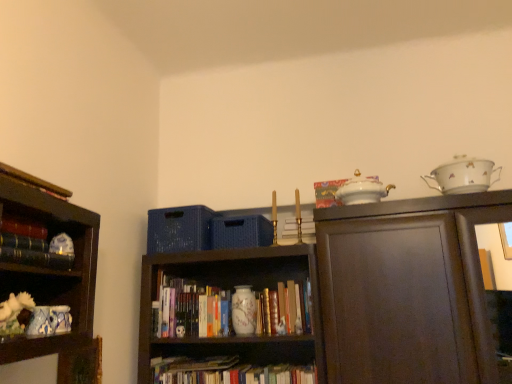
Locate an element on the screen. The height and width of the screenshot is (384, 512). white porcelain tea set at upper right is located at coordinates (463, 175).

What do you see at coordinates (190, 310) in the screenshot?
I see `hardcover books at center, the second book in the left-to-right sequence` at bounding box center [190, 310].

How much space does hardcover books at center, arranged as the 2th book when viewed from the right, occupy horizontally?

hardcover books at center, arranged as the 2th book when viewed from the right, is 32.24 centimeters in width.

Locate an element on the screen. hardcover book at center, placed as the 2th book when sorted from front to back is located at coordinates (284, 309).

Based on the photo, considering their positions, is hardcover book at center, which appears as the second book when viewed from the back, located in front of or behind white porcelain teapot at upper center?

hardcover book at center, which appears as the second book when viewed from the back, is positioned farther from the viewer than white porcelain teapot at upper center.

Looking at the image, does hardcover book at center, placed as the 2th book when sorted from front to back, seem bigger or smaller compared to white porcelain teapot at upper center?

In the image, hardcover book at center, placed as the 2th book when sorted from front to back, appears to be smaller than white porcelain teapot at upper center.

Could white porcelain teapot at upper center be considered to be inside hardcover book at center, which appears as the second book when viewed from the back?

No, white porcelain teapot at upper center is not inside hardcover book at center, which appears as the second book when viewed from the back.

Is point (293, 326) closer to viewer compared to point (360, 190)?

No, (293, 326) is behind (360, 190).

Identify the location of book that appears in front of the white porcelain tea set at upper right. This screenshot has width=512, height=384. (36, 258).

Is matte black book at left, placed as the third book when sorted from back to front, far away from white porcelain tea set at upper right?

matte black book at left, placed as the third book when sorted from back to front, is positioned a significant distance from white porcelain tea set at upper right.

Is matte black book at left, which ranks as the third book in bottom-to-top order, turned away from white porcelain tea set at upper right?

matte black book at left, which ranks as the third book in bottom-to-top order, does not have its back to white porcelain tea set at upper right.

Can you confirm if matte black book at left, placed as the third book when sorted from back to front, is positioned to the left of white porcelain tea set at upper right?

Yes, matte black book at left, placed as the third book when sorted from back to front, is to the left of white porcelain tea set at upper right.

What's the angular difference between white porcelain tea set at upper right and hardcover book at center, the 2th book viewed from the top,'s facing directions?

The angle between the facing direction of white porcelain tea set at upper right and the facing direction of hardcover book at center, the 2th book viewed from the top, is 0.272 degrees.

Does white porcelain tea set at upper right have a larger size compared to hardcover book at center, which ranks as the 3th book in left-to-right order?

Yes.

Is white porcelain tea set at upper right not near hardcover book at center, placed as the 2th book when sorted from front to back?

No, white porcelain tea set at upper right is not far from hardcover book at center, placed as the 2th book when sorted from front to back.

Would you say white porcelain tea set at upper right is to the left or to the right of hardcover book at center, which is the 2th book in bottom-to-top order, in the picture?

Based on their positions, white porcelain tea set at upper right is located to the right of hardcover book at center, which is the 2th book in bottom-to-top order.

Between hardcover book at center, which ranks as the 3th book in left-to-right order, and hardcover books at center, which appears as the third book when viewed from the top, which one has larger width?

Wider between the two is hardcover books at center, which appears as the third book when viewed from the top.

Is hardcover book at center, which is the 2th book in bottom-to-top order, with hardcover books at center, arranged as the 2th book when viewed from the right?

There is a gap between hardcover book at center, which is the 2th book in bottom-to-top order, and hardcover books at center, arranged as the 2th book when viewed from the right.

Is hardcover book at center, which is the 2th book in bottom-to-top order, oriented towards hardcover books at center, which is the 1th book in back-to-front order?

No, hardcover book at center, which is the 2th book in bottom-to-top order, is not turned towards hardcover books at center, which is the 1th book in back-to-front order.

From the picture: Considering the positions of objects hardcover book at center, which ranks as the 3th book in left-to-right order, and hardcover books at center, arranged as the 2th book when viewed from the right, in the image provided, who is more to the right, hardcover book at center, which ranks as the 3th book in left-to-right order, or hardcover books at center, arranged as the 2th book when viewed from the right,?

From the viewer's perspective, hardcover book at center, which ranks as the 3th book in left-to-right order, appears more on the right side.

Is matte black book at left, positioned as the first book in left-to-right order, to the left of hardcover book at center, which is the 2th book in bottom-to-top order, from the viewer's perspective?

Yes.

Does matte black book at left, positioned as the first book in left-to-right order, have a lesser width compared to hardcover book at center, the 2th book viewed from the top?

Yes.

From the picture: How different are the orientations of matte black book at left, positioned as the first book in left-to-right order, and hardcover book at center, which is the 2th book in bottom-to-top order, in degrees?

94.2 degrees separate the facing orientations of matte black book at left, positioned as the first book in left-to-right order, and hardcover book at center, which is the 2th book in bottom-to-top order.

Looking at this image, from a real-world perspective, is matte black book at left, positioned as the third book in right-to-left order, positioned above or below hardcover book at center, placed as the 2th book when sorted from front to back?

From a real-world perspective, matte black book at left, positioned as the third book in right-to-left order, is physically above hardcover book at center, placed as the 2th book when sorted from front to back.

Can you tell me how much hardcover books at center, the second book in the left-to-right sequence, and white porcelain teapot at upper center differ in facing direction?

There is a 1.98-degree angle between the facing directions of hardcover books at center, the second book in the left-to-right sequence, and white porcelain teapot at upper center.

Does point (170, 289) appear closer or farther from the camera than point (352, 179)?

Point (170, 289) is positioned farther from the camera compared to point (352, 179).

This screenshot has width=512, height=384. In the image, there is a hardcover books at center, which is the 1th book in back-to-front order. What are the coordinates of `tea pot above it (from the image's perspective)` in the screenshot? It's located at (362, 190).

From their relative heights in the image, would you say hardcover books at center, the 1th book ordered from the bottom, is taller or shorter than white porcelain teapot at upper center?

Considering their sizes, hardcover books at center, the 1th book ordered from the bottom, has more height than white porcelain teapot at upper center.

Consider the image. Between white porcelain teapot at upper center and matte black book at left, the first book viewed from the front, which one has more height?

white porcelain teapot at upper center is taller.

From a real-world perspective, is white porcelain teapot at upper center under matte black book at left, which is the first book from top to bottom?

Actually, white porcelain teapot at upper center is physically above matte black book at left, which is the first book from top to bottom, in the real world.

Is white porcelain teapot at upper center facing towards matte black book at left, the first book viewed from the front?

No, white porcelain teapot at upper center does not turn towards matte black book at left, the first book viewed from the front.

Is white porcelain teapot at upper center not close to matte black book at left, positioned as the third book in right-to-left order?

Absolutely, white porcelain teapot at upper center is distant from matte black book at left, positioned as the third book in right-to-left order.

Identify the location of the 1st book behind when counting from the white porcelain teapot at upper center. coord(284,309).

Find the location of a particular element. book in front of the white porcelain tea set at upper right is located at coordinates (36, 258).

Which object lies nearer to the anchor point white porcelain tea set at upper right, white porcelain teapot at upper center or matte black book at left, positioned as the third book in right-to-left order?

Among the two, white porcelain teapot at upper center is located nearer to white porcelain tea set at upper right.

Considering their positions, is hardcover book at center, the first book from the right, positioned closer to white porcelain tea set at upper right than white porcelain teapot at upper center?

Among the two, white porcelain teapot at upper center is located nearer to white porcelain tea set at upper right.

When comparing their distances from matte black book at left, positioned as the third book in right-to-left order, does white porcelain teapot at upper center or hardcover book at center, which is the 2th book in bottom-to-top order, seem further?

hardcover book at center, which is the 2th book in bottom-to-top order, is further to matte black book at left, positioned as the third book in right-to-left order.

Which object lies further to the anchor point matte black book at left, placed as the third book when sorted from back to front, white porcelain tea set at upper right or hardcover books at center, the 1th book ordered from the bottom?

white porcelain tea set at upper right is positioned further to the anchor matte black book at left, placed as the third book when sorted from back to front.

Based on their spatial positions, is white porcelain tea set at upper right or hardcover book at center, placed as the 2th book when sorted from front to back, closer to white porcelain teapot at upper center?

white porcelain tea set at upper right lies closer to white porcelain teapot at upper center than the other object.

Which object lies nearer to the anchor point matte black book at left, placed as the third book when sorted from back to front, hardcover book at center, the 2th book viewed from the top, or hardcover books at center, arranged as the 2th book when viewed from the right?

Among the two, hardcover books at center, arranged as the 2th book when viewed from the right, is located nearer to matte black book at left, placed as the third book when sorted from back to front.

From the image, which object appears to be farther from hardcover book at center, which appears as the second book when viewed from the back, hardcover books at center, the 1th book ordered from the bottom, or matte black book at left, the first book viewed from the front?

matte black book at left, the first book viewed from the front, lies further to hardcover book at center, which appears as the second book when viewed from the back, than the other object.

When comparing their distances from white porcelain tea set at upper right, does hardcover book at center, the 2th book viewed from the top, or hardcover books at center, the 1th book ordered from the bottom, seem further?

hardcover books at center, the 1th book ordered from the bottom, is positioned further to the anchor white porcelain tea set at upper right.

Find the location of a particular element. The height and width of the screenshot is (384, 512). tea pot located between hardcover books at center, arranged as the 2th book when viewed from the right, and white porcelain tea set at upper right in the left-right direction is located at coordinates (362, 190).

Locate an element on the screen. tea pot that lies between white porcelain tea set at upper right and hardcover book at center, which appears as the second book when viewed from the back, from top to bottom is located at coordinates (362, 190).

Identify the location of book positioned between matte black book at left, the first book viewed from the front, and hardcover books at center, the 3th book in the front-to-back sequence, from near to far. (284, 309).

Locate an element on the screen. The height and width of the screenshot is (384, 512). tea pot between matte black book at left, the first book viewed from the front, and hardcover book at center, which ranks as the 3th book in left-to-right order, along the z-axis is located at coordinates (362, 190).